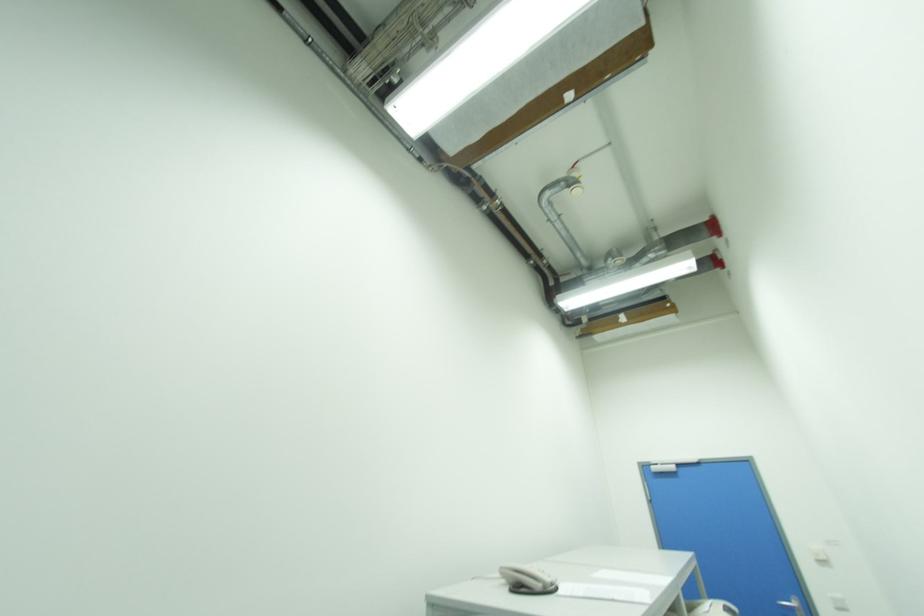
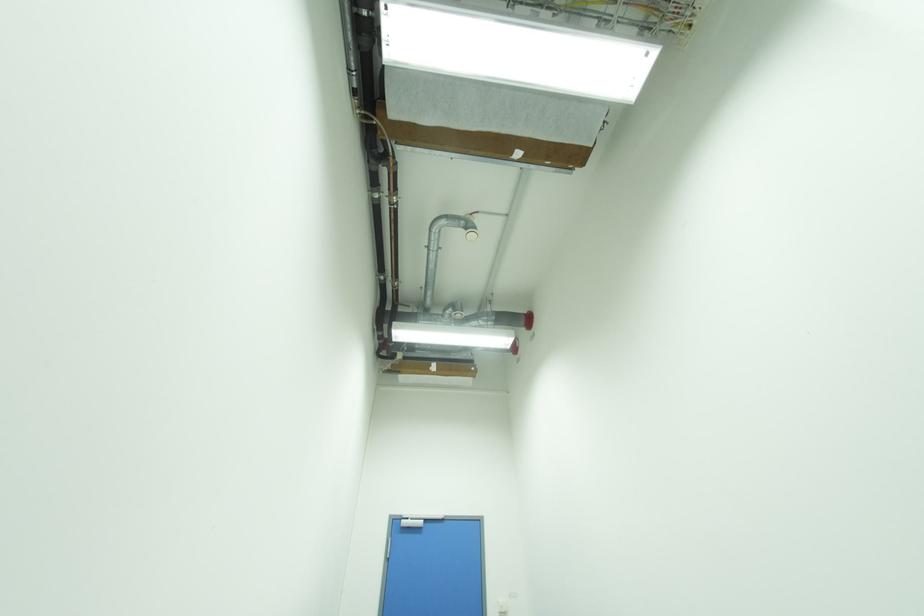
Question: How did the camera likely rotate?

Choices:
 (A) Left
 (B) Right
 (C) Up
 (D) Down

Answer: (B)